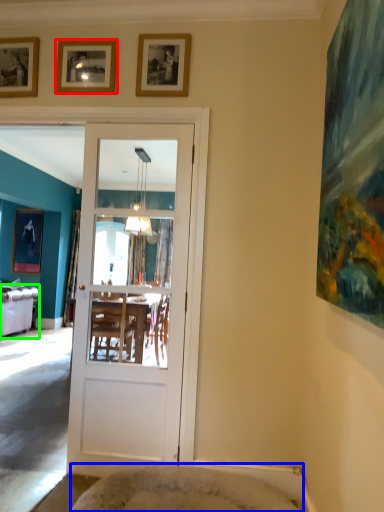
Question: Which object is positioned closest to picture frame (highlighted by a red box)? Select from cat bed (highlighted by a blue box) and studio couch (highlighted by a green box).

Choices:
 (A) cat bed
 (B) studio couch

Answer: (A)